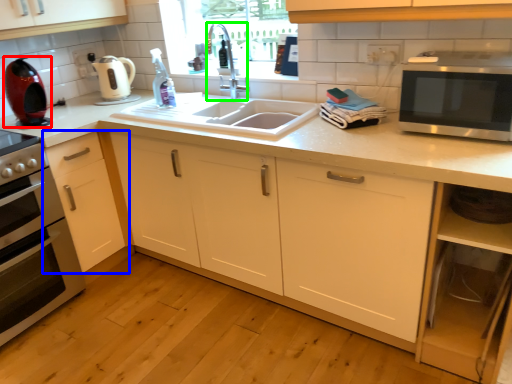
Question: Which object is the farthest from coffee machine (highlighted by a red box)? Choose among these: cabinetry (highlighted by a blue box) or faucet (highlighted by a green box).

Choices:
 (A) cabinetry
 (B) faucet

Answer: (B)